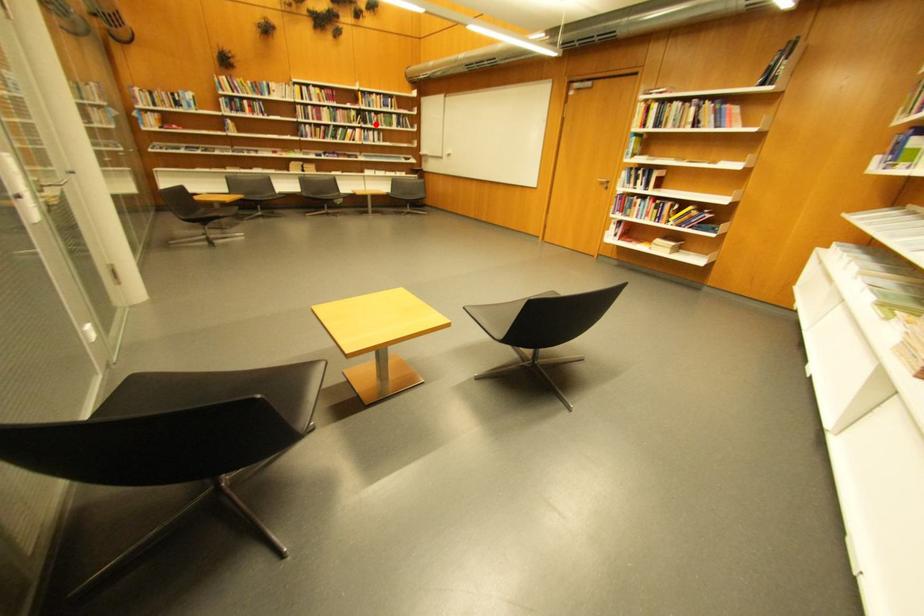
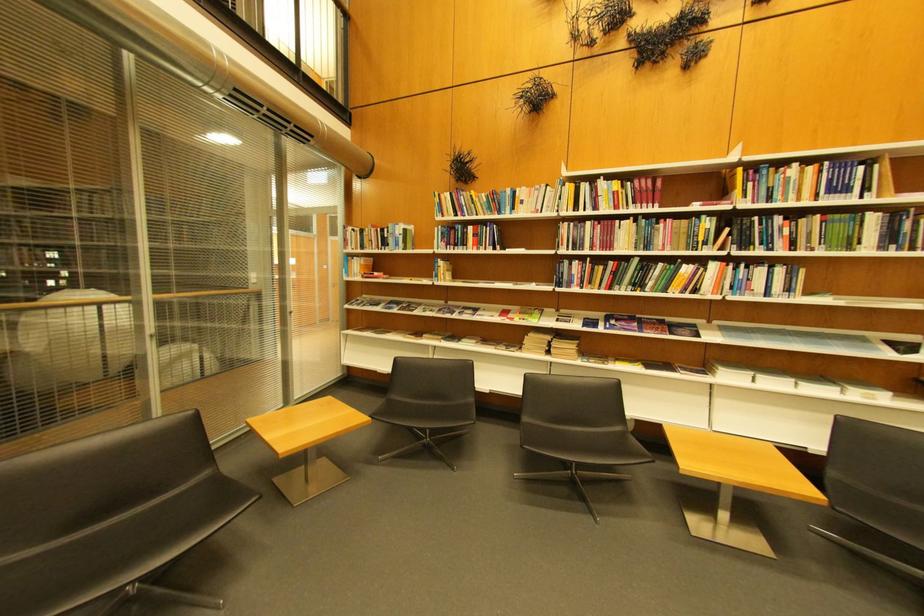
Question: I am providing you with two images of the same scene from different viewpoints. Given a red point in image1, look at the same physical point in image2. Is it:

Choices:
 (A) Closer to the viewpoint
 (B) Farther from the viewpoint

Answer: (B)